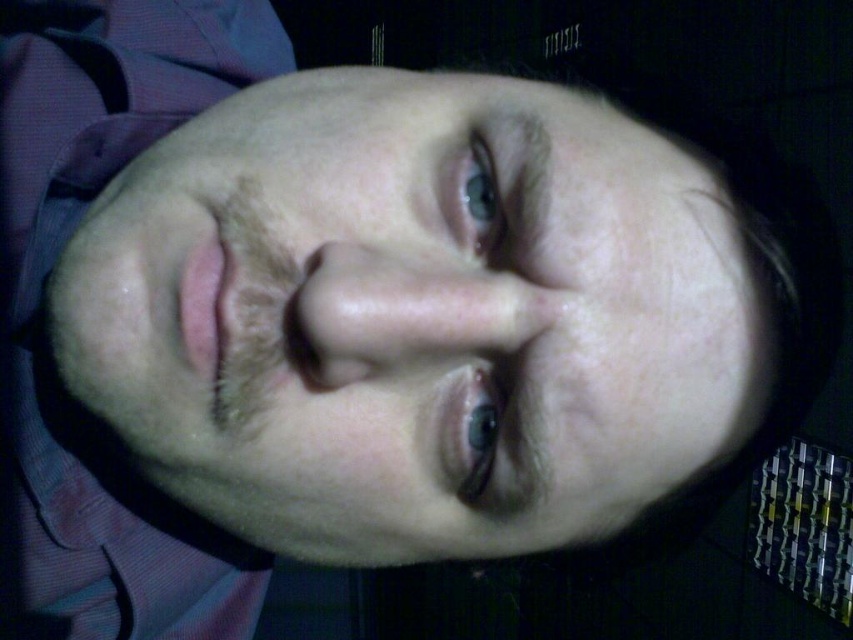
Question: Which of the following is the farthest from the observer?

Choices:
 (A) (473, 426)
 (B) (473, 195)
 (C) (109, 1)
 (D) (312, 234)

Answer: (C)

Question: Which object is positioned farthest from the blue glossy eye at upper center?

Choices:
 (A) pink fabric shirt at left
 (B) smooth skin face at center
 (C) blue glossy eye at center

Answer: (A)

Question: Can you confirm if smooth skin face at center is positioned to the right of pink fabric shirt at left?

Choices:
 (A) no
 (B) yes

Answer: (B)

Question: From the image, what is the correct spatial relationship of pink fabric shirt at left in relation to blue glossy eye at center?

Choices:
 (A) right
 (B) left

Answer: (B)

Question: In this image, where is blue glossy eye at upper center located relative to blue glossy eye at center?

Choices:
 (A) left
 (B) right

Answer: (A)

Question: Which of the following is the farthest from the observer?

Choices:
 (A) (474, 436)
 (B) (485, 188)

Answer: (B)